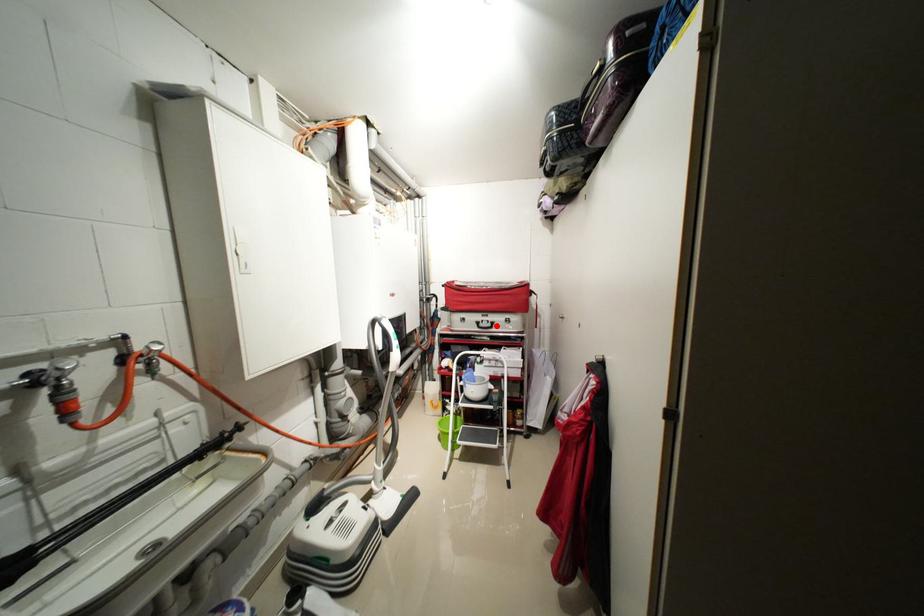
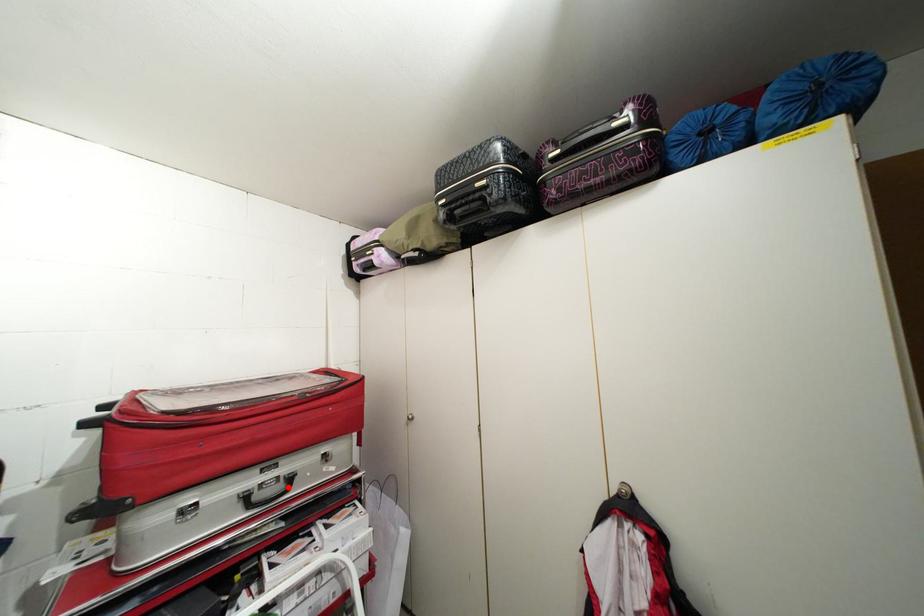
I am providing you with two images of the same scene from different viewpoints. A red point is marked on the first image and another point is marked on the second image. Is the red point in image1 aligned with the point shown in image2?

Yes